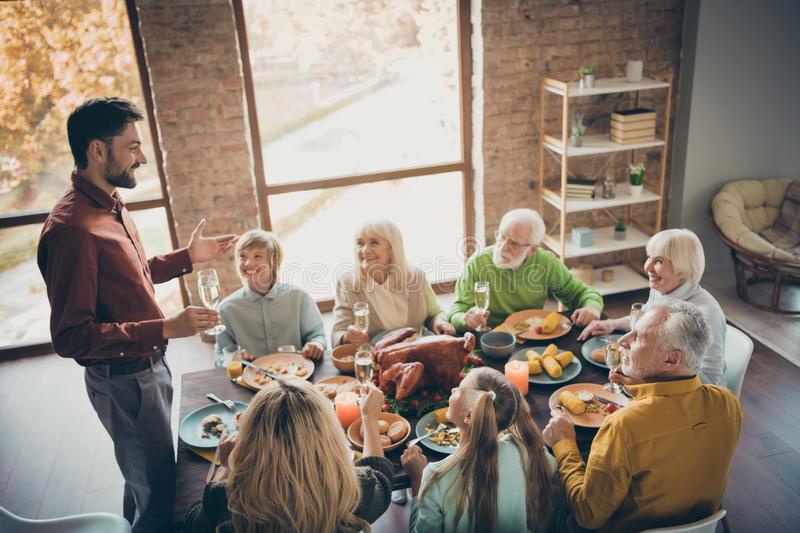
Identify the location of window panes. This screenshot has width=800, height=533. (142, 193), (150, 217), (318, 156), (320, 228).